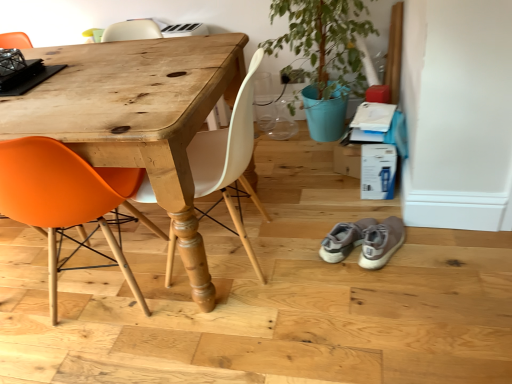
Question: Are green matte potted plant at upper right and matte white chair at center, the 2th chair viewed from the left, making contact?

Choices:
 (A) no
 (B) yes

Answer: (A)

Question: Could you tell me if green matte potted plant at upper right is turned towards matte white chair at center, the 2th chair viewed from the left?

Choices:
 (A) no
 (B) yes

Answer: (B)

Question: Is green matte potted plant at upper right in front of matte white chair at center, the 2th chair viewed from the left?

Choices:
 (A) no
 (B) yes

Answer: (A)

Question: Considering the relative sizes of green matte potted plant at upper right and matte white chair at center, the 2th chair viewed from the left, in the image provided, is green matte potted plant at upper right wider than matte white chair at center, the 2th chair viewed from the left,?

Choices:
 (A) yes
 (B) no

Answer: (A)

Question: Is green matte potted plant at upper right shorter than matte white chair at center, arranged as the 1th chair when viewed from the right?

Choices:
 (A) yes
 (B) no

Answer: (B)

Question: Considering their positions, is orange matte chair at left, which is the second chair in right-to-left order, located in front of or behind green matte potted plant at upper right?

Choices:
 (A) front
 (B) behind

Answer: (A)

Question: Would you say orange matte chair at left, which is the 1th chair in left-to-right order, is inside or outside green matte potted plant at upper right?

Choices:
 (A) inside
 (B) outside

Answer: (B)

Question: From a real-world perspective, is orange matte chair at left, which is the second chair in right-to-left order, above or below green matte potted plant at upper right?

Choices:
 (A) above
 (B) below

Answer: (B)

Question: Considering the positions of point (35, 187) and point (340, 39), is point (35, 187) closer or farther from the camera than point (340, 39)?

Choices:
 (A) farther
 (B) closer

Answer: (B)

Question: In terms of width, does green matte potted plant at upper right look wider or thinner when compared to matte white chair at center, arranged as the 1th chair when viewed from the right?

Choices:
 (A) thin
 (B) wide

Answer: (B)

Question: Is point (364, 84) closer or farther from the camera than point (224, 193)?

Choices:
 (A) farther
 (B) closer

Answer: (A)

Question: Is green matte potted plant at upper right taller or shorter than matte white chair at center, the 2th chair viewed from the left?

Choices:
 (A) tall
 (B) short

Answer: (A)

Question: In terms of size, does green matte potted plant at upper right appear bigger or smaller than matte white chair at center, arranged as the 1th chair when viewed from the right?

Choices:
 (A) small
 (B) big

Answer: (B)

Question: Is green matte potted plant at upper right inside or outside of orange matte chair at left, which is the 1th chair in left-to-right order?

Choices:
 (A) inside
 (B) outside

Answer: (B)

Question: Considering the positions of green matte potted plant at upper right and orange matte chair at left, which is the second chair in right-to-left order, in the image, is green matte potted plant at upper right bigger or smaller than orange matte chair at left, which is the second chair in right-to-left order,?

Choices:
 (A) big
 (B) small

Answer: (A)